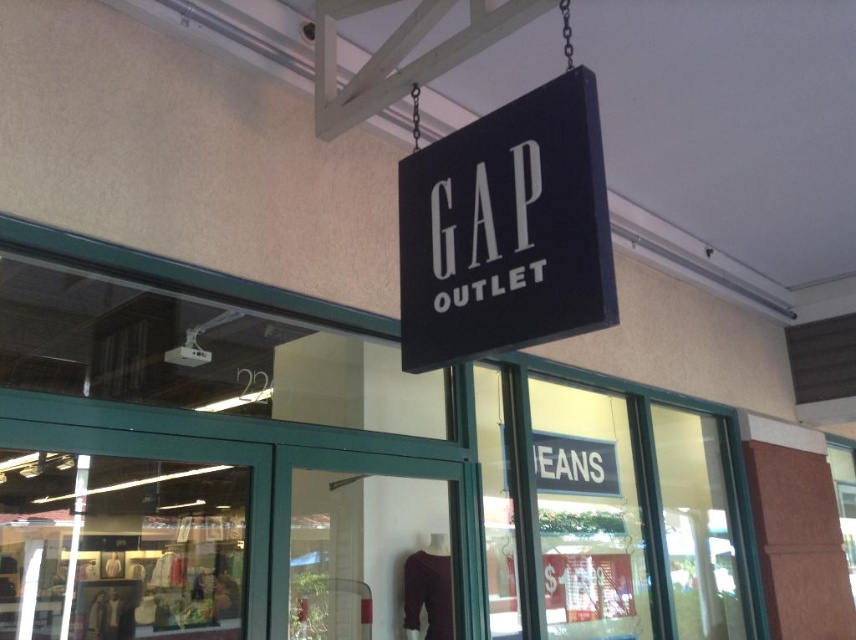
Question: Is black matte sign at center positioned in front of matte glass door at center?

Choices:
 (A) yes
 (B) no

Answer: (A)

Question: Can you confirm if black matte sign at center is positioned to the right of matte glass door at center?

Choices:
 (A) yes
 (B) no

Answer: (A)

Question: Which object appears farthest from the camera in this image?

Choices:
 (A) black matte sign at center
 (B) matte glass door at center

Answer: (B)

Question: Can you confirm if black matte sign at center is positioned below matte glass door at center?

Choices:
 (A) no
 (B) yes

Answer: (A)

Question: Which object appears closest to the camera in this image?

Choices:
 (A) matte glass door at center
 (B) black matte sign at center

Answer: (B)